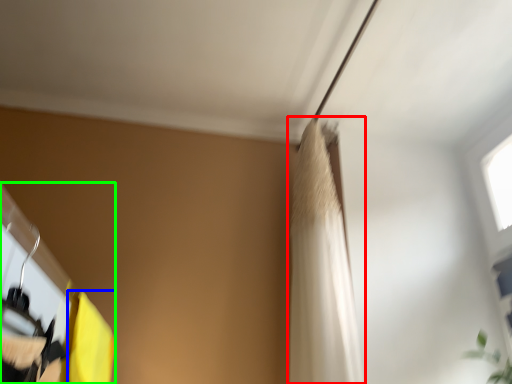
Question: Considering the real-world distances, which object is farthest from shower curtain (highlighted by a red box)? curtain (highlighted by a blue box) or closet (highlighted by a green box)?

Choices:
 (A) curtain
 (B) closet

Answer: (B)